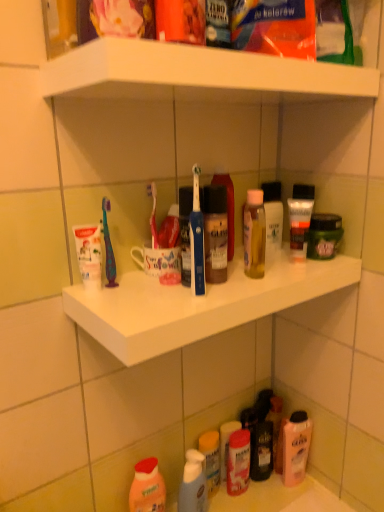
The height and width of the screenshot is (512, 384). What do you see at coordinates (238, 462) in the screenshot?
I see `matte plastic container at lower center, acting as the 2th toiletry starting from the left` at bounding box center [238, 462].

Locate an element on the screen. This screenshot has width=384, height=512. translucent plastic bottles at lower center is located at coordinates (259, 496).

Measure the distance between white glossy shelf at upper center and camera.

white glossy shelf at upper center is 20.48 inches away from camera.

What do you see at coordinates (89, 254) in the screenshot? I see `white matte toothpaste at left` at bounding box center [89, 254].

The width and height of the screenshot is (384, 512). What do you see at coordinates (300, 219) in the screenshot? I see `translucent plastic tube at upper center, positioned as the 4th toiletry in bottom-to-top order` at bounding box center [300, 219].

The image size is (384, 512). What are the coordinates of `matte plastic container at lower center, which ranks as the third toiletry in top-to-bottom order` in the screenshot? It's located at (238, 462).

Can you confirm if matte white tube at upper right, arranged as the third toiletry when ordered from the bottom, is wider than blue plastic toothbrush at center?

Yes, matte white tube at upper right, arranged as the third toiletry when ordered from the bottom, is wider than blue plastic toothbrush at center.

Does matte white tube at upper right, the 2th toiletry in the top-to-bottom sequence, have a greater height compared to blue plastic toothbrush at center?

No.

Is matte white tube at upper right, which is the 4th toiletry from left to right, not near blue plastic toothbrush at center?

No, matte white tube at upper right, which is the 4th toiletry from left to right, is in close proximity to blue plastic toothbrush at center.

Between point (317, 256) and point (193, 280), which one is positioned in front?

Positioned in front is point (193, 280).

Considering the sizes of translucent plastic bottle at lower center, the second cleaning product in the back-to-front sequence, and white matte toothpaste at left in the image, is translucent plastic bottle at lower center, the second cleaning product in the back-to-front sequence, bigger or smaller than white matte toothpaste at left?

In the image, translucent plastic bottle at lower center, the second cleaning product in the back-to-front sequence, appears to be larger than white matte toothpaste at left.

Between translucent plastic bottle at lower center, positioned as the 1th cleaning product in left-to-right order, and white matte toothpaste at left, which one is positioned behind?

Positioned behind is translucent plastic bottle at lower center, positioned as the 1th cleaning product in left-to-right order.

From the image's perspective, which one is positioned higher, translucent plastic bottle at lower center, positioned as the 1th cleaning product in left-to-right order, or white matte toothpaste at left?

From the image's view, white matte toothpaste at left is above.

Can you tell me how much translucent plastic bottle at lower center, which ranks as the 2th cleaning product in right-to-left order, and white matte toothpaste at left differ in facing direction?

The angle between the facing direction of translucent plastic bottle at lower center, which ranks as the 2th cleaning product in right-to-left order, and the facing direction of white matte toothpaste at left is 0.716 degrees.

Is blue plastic toothbrush at center positioned before matte plastic container at lower center, arranged as the 3th toiletry when viewed from the right?

Yes, blue plastic toothbrush at center is closer to the camera.

Is point (193, 253) positioned after point (237, 490)?

No, (193, 253) is closer to viewer.

From a real-world perspective, between blue plastic toothbrush at center and matte plastic container at lower center, positioned as the 2th toiletry in bottom-to-top order, who is vertically higher?

blue plastic toothbrush at center is physically above.

Is blue plastic toothbrush at center placed right next to matte plastic container at lower center, which ranks as the third toiletry in top-to-bottom order?

No, blue plastic toothbrush at center is not with matte plastic container at lower center, which ranks as the third toiletry in top-to-bottom order.

Who is shorter, matte white tube at upper right, the 2th toiletry in the top-to-bottom sequence, or translucent plastic bottles at lower center?

With less height is translucent plastic bottles at lower center.

Is matte white tube at upper right, arranged as the third toiletry when ordered from the bottom, aimed at translucent plastic bottles at lower center?

No, matte white tube at upper right, arranged as the third toiletry when ordered from the bottom, is not facing towards translucent plastic bottles at lower center.

Is matte white tube at upper right, the first toiletry from the right, smaller than translucent plastic bottles at lower center?

Correct, matte white tube at upper right, the first toiletry from the right, occupies less space than translucent plastic bottles at lower center.

Considering the relative positions of matte white tube at upper right, arranged as the third toiletry when ordered from the bottom, and white glossy shelf at upper center in the image provided, is matte white tube at upper right, arranged as the third toiletry when ordered from the bottom, to the right of white glossy shelf at upper center from the viewer's perspective?

Correct, you'll find matte white tube at upper right, arranged as the third toiletry when ordered from the bottom, to the right of white glossy shelf at upper center.

You are a GUI agent. You are given a task and a screenshot of the screen. Output one action in this format:
    pyautogui.click(x=<x>, y=<y>)
    Task: Click on the toiletry that is the 3rd one when counting rightward from the white glossy shelf at upper center
    Image resolution: width=384 pixels, height=512 pixels.
    Given the screenshot: What is the action you would take?
    pyautogui.click(x=324, y=234)

Are matte white tube at upper right, arranged as the third toiletry when ordered from the bottom, and white glossy shelf at upper center making contact?

They are not placed beside each other.

Which of these two, matte white tube at upper right, the first toiletry from the right, or white glossy shelf at upper center, is bigger?

With larger size is white glossy shelf at upper center.

From a real-world perspective, is matte plastic container at lower center, positioned as the 2th toiletry in bottom-to-top order, located beneath matte white tube at upper right, the first toiletry from the right?

Yes.

Looking at this image, are matte plastic container at lower center, arranged as the 3th toiletry when viewed from the right, and matte white tube at upper right, the first toiletry from the right, making contact?

No.

Considering the sizes of objects matte plastic container at lower center, which ranks as the third toiletry in top-to-bottom order, and matte white tube at upper right, arranged as the third toiletry when ordered from the bottom, in the image provided, who is bigger, matte plastic container at lower center, which ranks as the third toiletry in top-to-bottom order, or matte white tube at upper right, arranged as the third toiletry when ordered from the bottom,?

Bigger between the two is matte plastic container at lower center, which ranks as the third toiletry in top-to-bottom order.

Is matte plastic container at lower center, positioned as the 2th toiletry in bottom-to-top order, turned away from matte white tube at upper right, which is the 4th toiletry from left to right?

No.

Which is in front, translucent plastic bottles at lower center or white matte toothpaste at left?

white matte toothpaste at left is more forward.

Is translucent plastic bottles at lower center with white matte toothpaste at left?

No, translucent plastic bottles at lower center is not in contact with white matte toothpaste at left.

Considering the sizes of objects translucent plastic bottles at lower center and white matte toothpaste at left in the image provided, who is wider, translucent plastic bottles at lower center or white matte toothpaste at left?

Wider between the two is translucent plastic bottles at lower center.

Is point (295, 509) less distant than point (74, 234)?

No.

At what (x,y) coordinates should I click in order to perform the action: click on toiletry that is the 4th object to the right of the blue plastic toothbrush at center, starting at the anchor. Please return your answer as a coordinate pair (x, y). Looking at the image, I should click on (324, 234).

This screenshot has height=512, width=384. In order to click on toothpaste above the translucent plastic bottle at lower center, which appears as the first cleaning product when viewed from the front (from a real-world perspective) in this screenshot , I will do `click(89, 254)`.

Estimate the real-world distances between objects in this image. Which object is closer to white matte toothpaste at left, matte white tube at upper right, which is the 4th toiletry from left to right, or translucent plastic bottle at lower center, positioned as the 1th cleaning product in left-to-right order?

matte white tube at upper right, which is the 4th toiletry from left to right, is closer to white matte toothpaste at left.

Estimate the real-world distances between objects in this image. Which object is closer to white matte toothpaste at left, white glossy shelf at upper center or translucent plastic bottles at lower center?

white glossy shelf at upper center.

From the image, which object appears to be nearer to translucent pink bottle at lower right, arranged as the first cleaning product when viewed from the back, white matte toothpaste at left or translucent plastic bottle at lower center, which ranks as the 2th cleaning product in right-to-left order?

translucent plastic bottle at lower center, which ranks as the 2th cleaning product in right-to-left order.

Based on their spatial positions, is translucent plastic spray bottle at lower center, the fourth toiletry when ordered from top to bottom, or white plastic shelf at center closer to white matte toothpaste at left?

white plastic shelf at center is positioned closer to the anchor white matte toothpaste at left.

Which object lies nearer to the anchor point translucent plastic spray bottle at lower center, the 1th toiletry in the bottom-to-top sequence, translucent plastic bottle at lower center, which appears as the first cleaning product when viewed from the front, or blue plastic toothbrush at center?

The object closer to translucent plastic spray bottle at lower center, the 1th toiletry in the bottom-to-top sequence, is translucent plastic bottle at lower center, which appears as the first cleaning product when viewed from the front.

From the image, which object appears to be nearer to translucent plastic bottle at lower center, positioned as the 1th cleaning product in left-to-right order, translucent plastic bottles at lower center or translucent pink bottle at lower right, the first cleaning product from the right?

translucent plastic bottles at lower center is positioned closer to the anchor translucent plastic bottle at lower center, positioned as the 1th cleaning product in left-to-right order.

Looking at the image, which one is located further to white plastic shelf at center, matte plastic container at lower center, positioned as the 2th toiletry in bottom-to-top order, or translucent plastic bottles at lower center?

translucent plastic bottles at lower center is further to white plastic shelf at center.

From the image, which object appears to be nearer to translucent plastic bottles at lower center, translucent plastic spray bottle at lower center, the first toiletry in the left-to-right sequence, or matte plastic container at lower center, arranged as the 3th toiletry when viewed from the right?

matte plastic container at lower center, arranged as the 3th toiletry when viewed from the right.

This screenshot has height=512, width=384. I want to click on ledge between white glossy shelf at upper center and matte plastic container at lower center, arranged as the 3th toiletry when viewed from the right, in the vertical direction, so click(198, 304).

Where is `cleaning product that lies between translucent plastic tube at upper center, the 2th toiletry in the right-to-left sequence, and matte plastic container at lower center, acting as the 2th toiletry starting from the left, from top to bottom`? cleaning product that lies between translucent plastic tube at upper center, the 2th toiletry in the right-to-left sequence, and matte plastic container at lower center, acting as the 2th toiletry starting from the left, from top to bottom is located at coordinates (295, 447).

I want to click on ledge between translucent plastic tube at upper center, the 2th toiletry in the right-to-left sequence, and matte plastic container at lower center, arranged as the 3th toiletry when viewed from the right, in the up-down direction, so click(x=198, y=304).

This screenshot has width=384, height=512. Find the location of `ledge between matte white tube at upper right, which is the 4th toiletry from left to right, and matte plastic container at lower center, positioned as the 2th toiletry in bottom-to-top order, from top to bottom`. ledge between matte white tube at upper right, which is the 4th toiletry from left to right, and matte plastic container at lower center, positioned as the 2th toiletry in bottom-to-top order, from top to bottom is located at coordinates (198, 304).